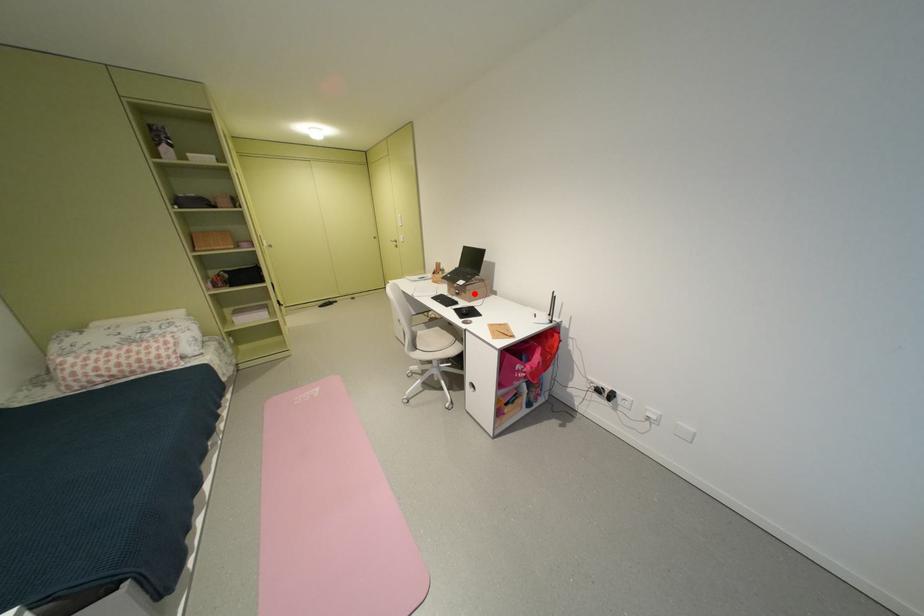
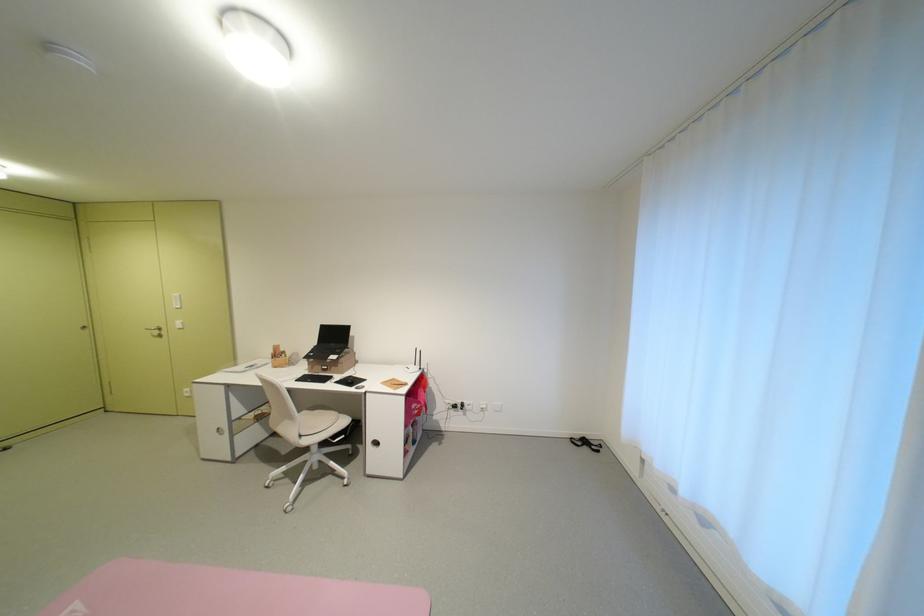
In the second image, find the point that corresponds to the highlighted location in the first image.

(346, 368)